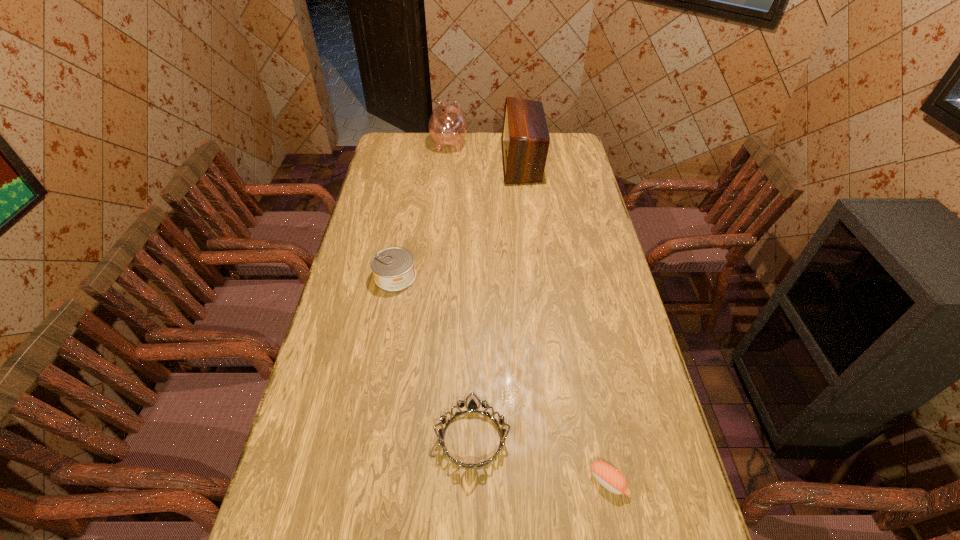
This screenshot has height=540, width=960. Identify the location of vacant area between the piggy bank and the sushi. (529, 313).

The height and width of the screenshot is (540, 960). What are the coordinates of `vacant space that is in between the third farthest object and the radio receiver` in the screenshot? It's located at point(459,219).

At what (x,y) coordinates should I click in order to perform the action: click on free spot between the third farthest object and the second tallest object. Please return your answer as a coordinate pair (x, y). This screenshot has width=960, height=540. Looking at the image, I should click on (422, 210).

In order to click on empty space that is in between the second tallest object and the radio receiver in this screenshot , I will do `click(486, 153)`.

Find the location of a particular element. vacant region between the radio receiver and the third nearest object is located at coordinates (459, 219).

You are a GUI agent. You are given a task and a screenshot of the screen. Output one action in this format:
    pyautogui.click(x=<x>, y=<y>)
    Task: Click on the unoccupied area between the radio receiver and the tiara
    
    Given the screenshot: What is the action you would take?
    pyautogui.click(x=497, y=300)

At what (x,y) coordinates should I click in order to perform the action: click on free point between the piggy bank and the tallest object. Please return your answer as a coordinate pair (x, y). This screenshot has height=540, width=960. Looking at the image, I should click on (486, 153).

The height and width of the screenshot is (540, 960). Identify the location of free point between the tiara and the sushi. (540, 460).

Identify the location of vacant space that is in between the second tallest object and the tallest object. This screenshot has width=960, height=540. (486, 153).

Find the location of a particular element. object that stands as the third closest to the fourth tallest object is located at coordinates (525, 141).